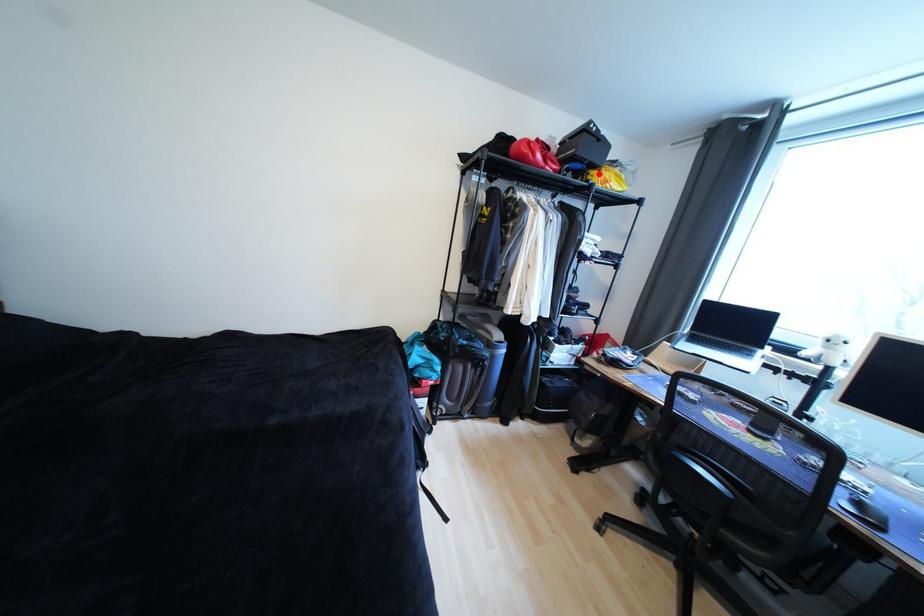
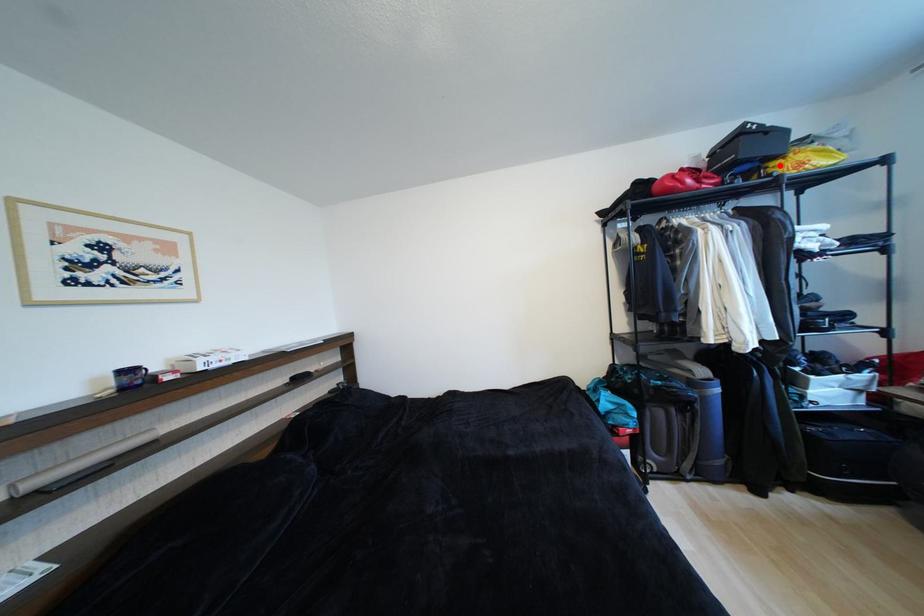
I am providing you with two images of the same scene from different viewpoints. A red point is marked on the first image and another point is marked on the second image. Are the points marked in image1 and image2 representing the same 3D position?

Yes